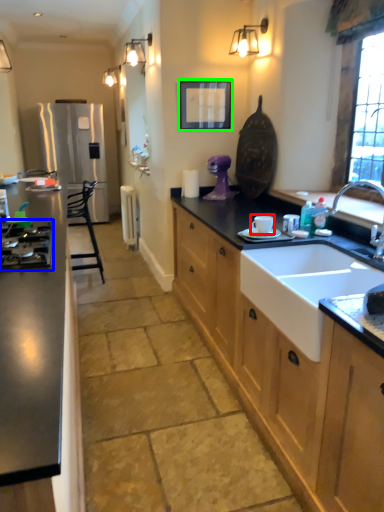
Question: Which is farther away from appliance (highlighted by a red box)? gas stove (highlighted by a blue box) or picture frame (highlighted by a green box)?

Choices:
 (A) gas stove
 (B) picture frame

Answer: (B)